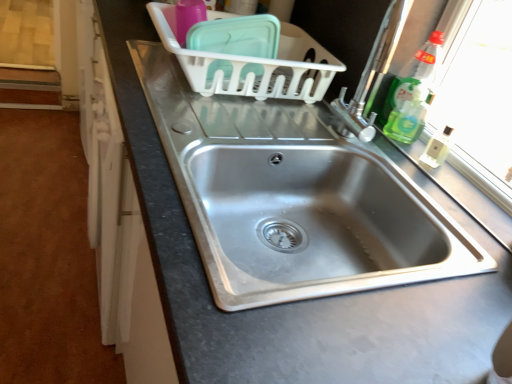
What are the coordinates of `vacant region to the right of clear plastic soap dispenser at right` in the screenshot? It's located at (468, 183).